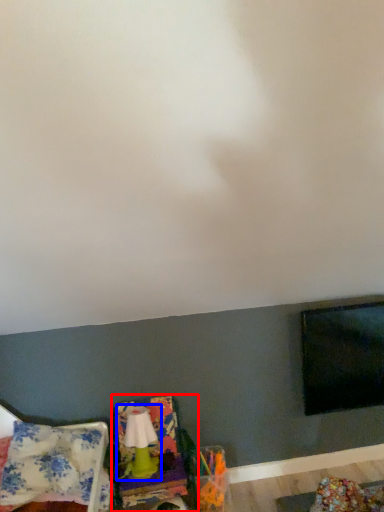
Question: Which object is closer to the camera taking this photo, swivel chair (highlighted by a red box) or lamp (highlighted by a blue box)?

Choices:
 (A) swivel chair
 (B) lamp

Answer: (A)